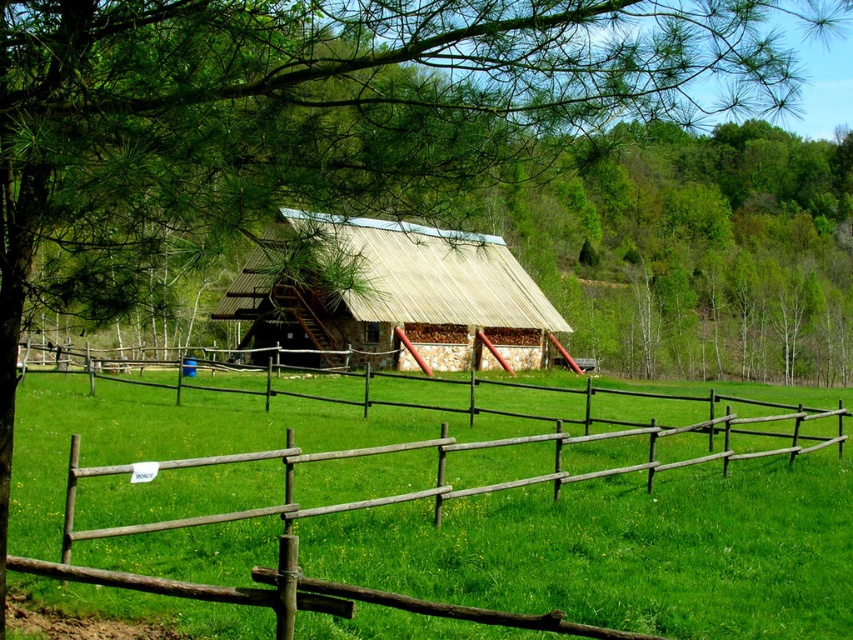
Question: Does brown wooden fence at center have a greater width compared to wooden thatched hut at center?

Choices:
 (A) no
 (B) yes

Answer: (B)

Question: Does brown wooden fence at center appear under wooden thatched hut at center?

Choices:
 (A) yes
 (B) no

Answer: (A)

Question: In this image, where is brown wooden fence at center located relative to wooden thatched hut at center?

Choices:
 (A) left
 (B) right

Answer: (B)

Question: Which of the following is the closest to the observer?

Choices:
 (A) brown wooden fence at center
 (B) wooden thatched hut at center

Answer: (B)